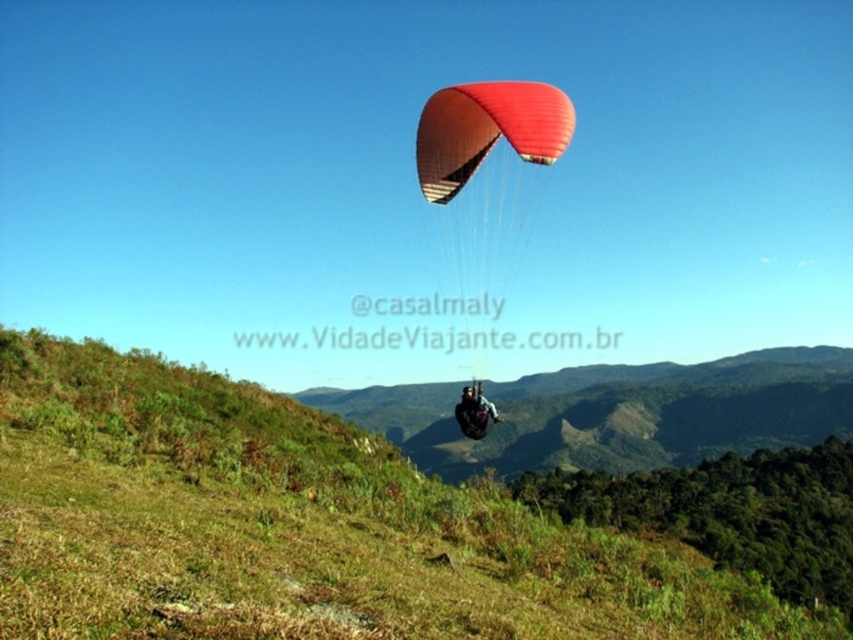
You are a paragliding instructor observing the scene. You need to determine the safest landing zone for your student. Considering the green grassy hillside at lower left and the matte black helmet at center, which area is closer to the ground and more suitable for landing?

The green grassy hillside at lower left is closer to the viewer than the matte black helmet at center, making it the safer and more suitable landing zone as it is nearer to the ground.

You are a paraglider pilot preparing to land. You see the green grassy hillside at lower left and the matte black helmet at center. Which area should you aim for to ensure a safe landing zone?

You should aim for the green grassy hillside at lower left because it is wider than the matte black helmet at center, providing a safer and more stable landing area.

You are a photographer trying to capture the paraglider in flight. You notice the matte red parachute at center and the matte black helmet at center. Which object should you focus on if you want to capture the larger of the two in your shot?

The matte black helmet at center is larger than the matte red parachute at center, so you should focus on the matte black helmet at center to capture the larger object in your shot.